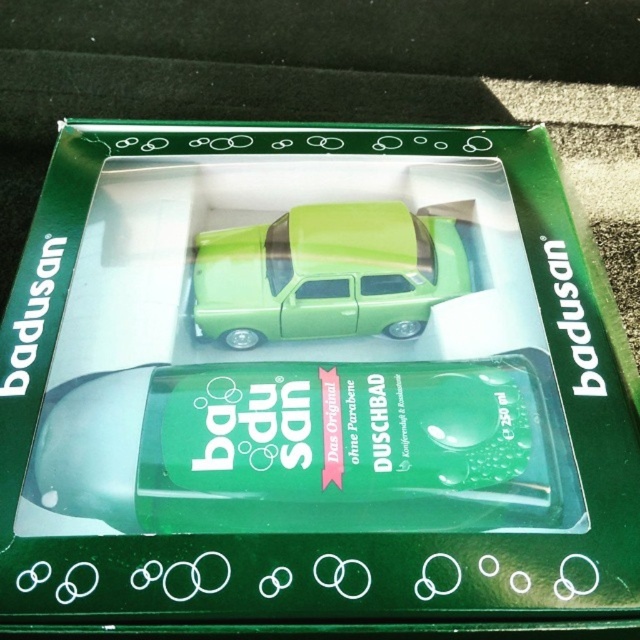
Consider the image. You are an online seller who wants to describe the packaging of this product. You need to mention both the green plastic car at center and the green glossy car at center. Which one is placed higher on the packaging?

The green glossy car at center is placed higher on the packaging than the green plastic car at center, as the green plastic car at center is located below it.

You are examining a product package and notice two points marked on it. The first point is at coordinates point (480, 410) and the second is at point (333, 248). Based on the spatial arrangement of the objects on the package, which point is closer to the front of the package?

Point (480, 410) is in front of point (333, 248), so the first point is closer to the front of the package.

What are the coordinates of the green plastic car at center in the image?

The green plastic car at center is located at coordinates (301, 448).